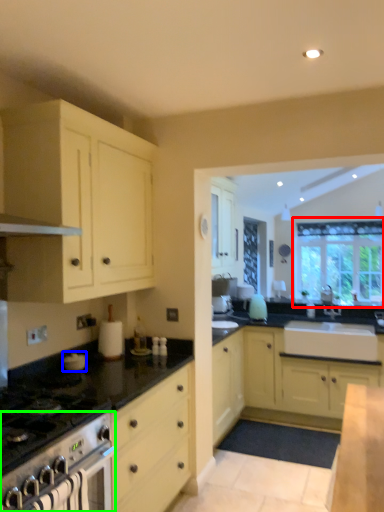
Question: Based on their relative distances, which object is nearer to window (highlighted by a red box)? Choose from appliance (highlighted by a blue box) and oven (highlighted by a green box).

Choices:
 (A) appliance
 (B) oven

Answer: (A)